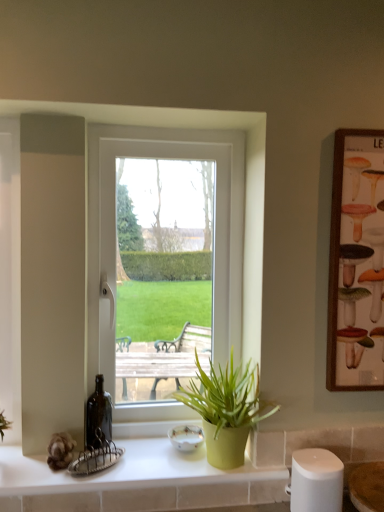
Find the location of a particular element. The image size is (384, 512). vacant area on top of white glossy countertop at lower center (from a real-world perspective) is located at coordinates (138, 461).